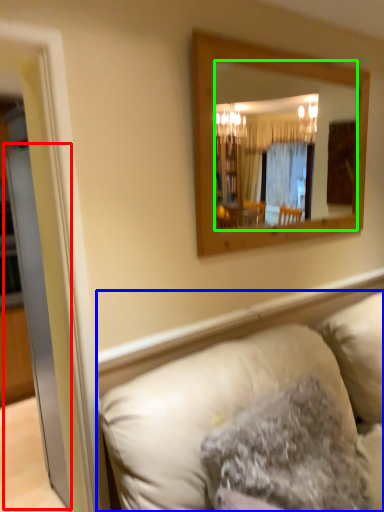
Question: Estimate the real-world distances between objects in this image. Which object is closer to glass door (highlighted by a red box), studio couch (highlighted by a blue box) or mirror (highlighted by a green box)?

Choices:
 (A) studio couch
 (B) mirror

Answer: (A)